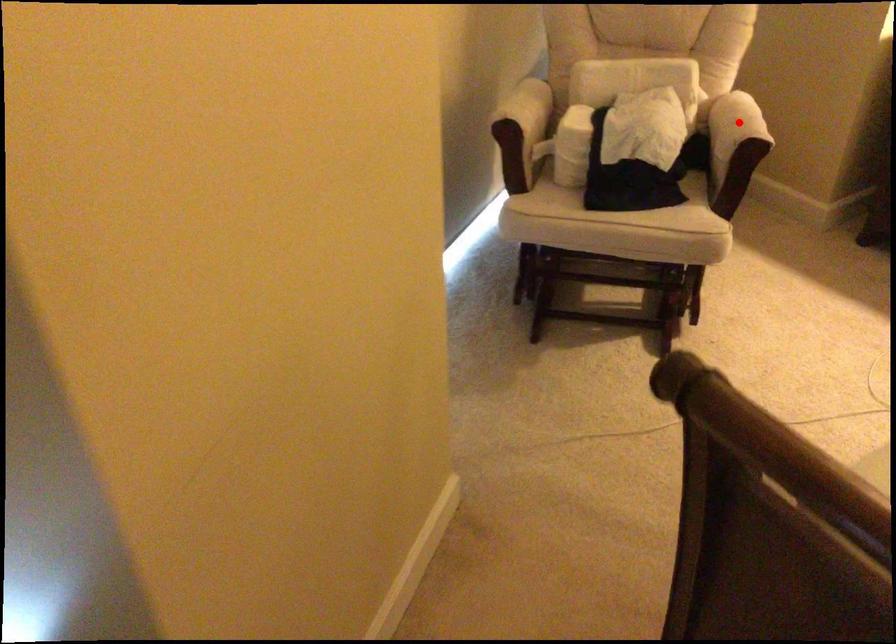
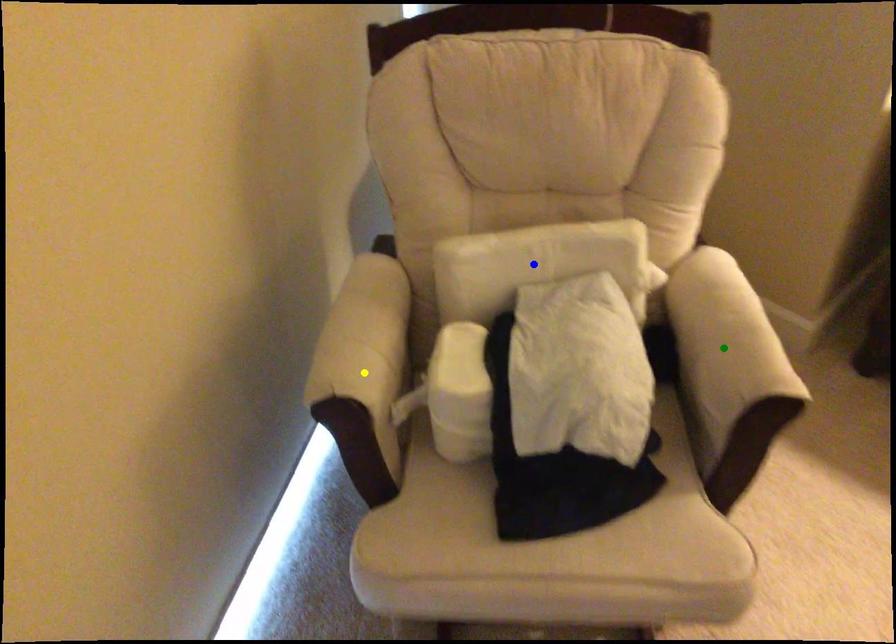
Question: I am providing you with two images of the same scene from different viewpoints. A red point is marked on the first image. You are given multiple points on the second image. Which point in image 2 represents the same 3d spot as the red point in image 1?

Choices:
 (A) green point
 (B) blue point
 (C) yellow point

Answer: (A)